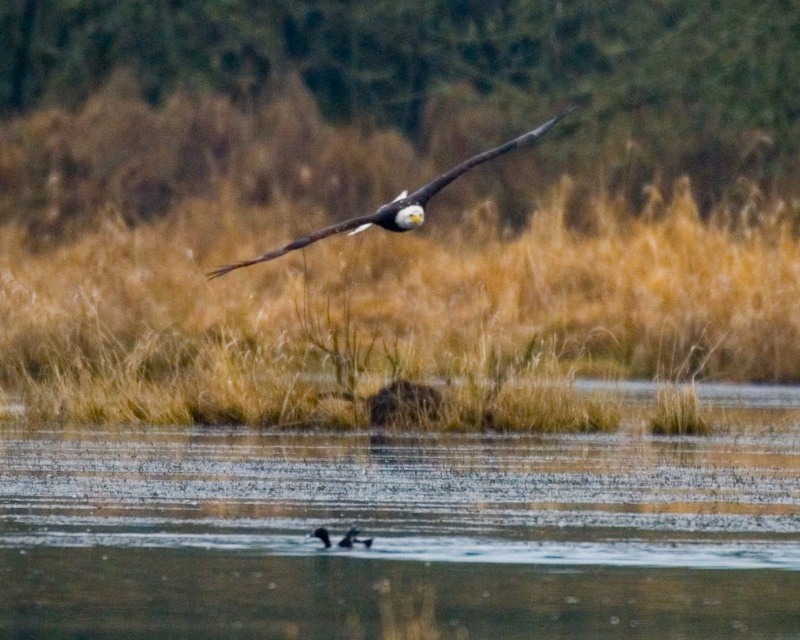
Is clear water at center bigger than white-feathered eagle at center?

Yes, clear water at center is bigger than white-feathered eagle at center.

Identify the location of clear water at center. Image resolution: width=800 pixels, height=640 pixels. (397, 534).

At what (x,y) coordinates should I click in order to perform the action: click on clear water at center. Please return your answer as a coordinate pair (x, y). Image resolution: width=800 pixels, height=640 pixels. Looking at the image, I should click on (397, 534).